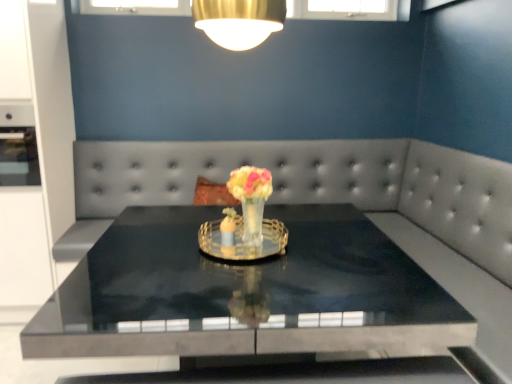
Find the location of a particular element. This screenshot has width=512, height=384. satin gray couch at center is located at coordinates (309, 186).

You are a GUI agent. You are given a task and a screenshot of the screen. Output one action in this format:
    pyautogui.click(x=<x>, y=<y>)
    Task: Click on the translucent glass vase at center
    This screenshot has height=384, width=512.
    Given the screenshot: What is the action you would take?
    pyautogui.click(x=251, y=199)

From the image's perspective, is black polished table at center above satin gray couch at center?

No, from the image's perspective, black polished table at center is not above satin gray couch at center.

Does point (388, 288) lie in front of point (397, 208)?

Yes, point (388, 288) is closer to viewer.

Visually, is black polished table at center positioned to the left or to the right of satin gray couch at center?

black polished table at center is positioned on satin gray couch at center's right side.

Is black polished table at center positioned with its back to satin gray couch at center?

Yes, black polished table at center is facing away from satin gray couch at center.

Between translucent glass vase at center and satin gray couch at center, which one has more height?

Standing taller between the two is satin gray couch at center.

Between translucent glass vase at center and satin gray couch at center, which one has larger size?

Bigger between the two is satin gray couch at center.

From a real-world perspective, is translucent glass vase at center over satin gray couch at center?

Yes.

Can you confirm if translucent glass vase at center is wider than satin gray couch at center?

No.

Does black polished table at center have a greater height compared to translucent glass vase at center?

Yes, black polished table at center is taller than translucent glass vase at center.

Considering the positions of objects black polished table at center and translucent glass vase at center in the image provided, who is in front, black polished table at center or translucent glass vase at center?

Positioned in front is black polished table at center.

Locate an element on the screen. The width and height of the screenshot is (512, 384). floral arrangement above the black polished table at center (from a real-world perspective) is located at coordinates (251, 199).

Is point (340, 249) closer or farther from the camera than point (247, 211)?

Point (340, 249) appears to be farther away from the viewer than point (247, 211).

In the image, is translucent glass vase at center positioned in front of or behind black polished table at center?

translucent glass vase at center is behind black polished table at center.

Considering the positions of objects translucent glass vase at center and black polished table at center in the image provided, who is more to the right, translucent glass vase at center or black polished table at center?

Positioned to the right is black polished table at center.

Based on their sizes in the image, would you say translucent glass vase at center is bigger or smaller than black polished table at center?

translucent glass vase at center is smaller than black polished table at center.

From the image's perspective, is translucent glass vase at center on black polished table at center?

Yes, from the image's perspective, translucent glass vase at center is over black polished table at center.

Are satin gray couch at center and translucent glass vase at center far apart?

Yes, satin gray couch at center is far from translucent glass vase at center.

Which is in front, point (317, 185) or point (246, 168)?

The point (246, 168) is more forward.

Considering the relative positions of satin gray couch at center and translucent glass vase at center in the image provided, is satin gray couch at center to the left or to the right of translucent glass vase at center?

From the image, it's evident that satin gray couch at center is to the left of translucent glass vase at center.

Considering the positions of objects satin gray couch at center and translucent glass vase at center in the image provided, who is in front, satin gray couch at center or translucent glass vase at center?

translucent glass vase at center.

Is satin gray couch at center wider than black polished table at center?

No.

Which is in front, satin gray couch at center or black polished table at center?

black polished table at center is in front.

From the picture: Is satin gray couch at center shorter than black polished table at center?

Incorrect, the height of satin gray couch at center does not fall short of that of black polished table at center.

Considering the relative sizes of satin gray couch at center and black polished table at center in the image provided, is satin gray couch at center bigger than black polished table at center?

No, satin gray couch at center is not bigger than black polished table at center.

In the image, there is a black polished table at center. Where is `couch above it (from the image's perspective)`? The image size is (512, 384). couch above it (from the image's perspective) is located at coordinates (309, 186).

The image size is (512, 384). Identify the location of floral arrangement above the satin gray couch at center (from a real-world perspective). (251, 199).

Based on their spatial positions, is black polished table at center or translucent glass vase at center closer to satin gray couch at center?

black polished table at center is closer to satin gray couch at center.

From the image, which object appears to be nearer to black polished table at center, translucent glass vase at center or satin gray couch at center?

translucent glass vase at center is closer to black polished table at center.

When comparing their distances from translucent glass vase at center, does satin gray couch at center or black polished table at center seem further?

The object further to translucent glass vase at center is satin gray couch at center.

Considering their positions, is satin gray couch at center positioned closer to black polished table at center than translucent glass vase at center?

translucent glass vase at center.

From the image, which object appears to be nearer to satin gray couch at center, translucent glass vase at center or black polished table at center?

Based on the image, black polished table at center appears to be nearer to satin gray couch at center.

Looking at the image, which one is located further to translucent glass vase at center, black polished table at center or satin gray couch at center?

Based on the image, satin gray couch at center appears to be further to translucent glass vase at center.

What are the coordinates of `floral arrangement between black polished table at center and satin gray couch at center in the front-back direction` in the screenshot? It's located at (251, 199).